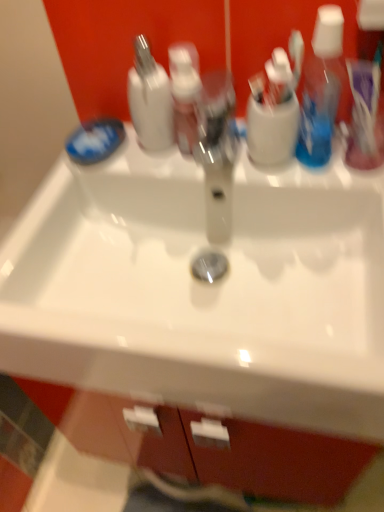
At what (x,y) coordinates should I click in order to perform the action: click on white glossy bottle at upper center. Please return your answer as a coordinate pair (x, y). This screenshot has width=384, height=512. Looking at the image, I should click on (150, 99).

The image size is (384, 512). What do you see at coordinates (150, 99) in the screenshot? I see `white glossy bottle at upper center` at bounding box center [150, 99].

Measure the distance between point (171, 82) and camera.

26.06 inches.

Find the location of `blue matte soap at left`. blue matte soap at left is located at coordinates (95, 140).

What do you see at coordinates (95, 140) in the screenshot?
I see `blue matte soap at left` at bounding box center [95, 140].

This screenshot has width=384, height=512. What do you see at coordinates (204, 290) in the screenshot?
I see `white glossy sink at center` at bounding box center [204, 290].

I want to click on translucent plastic toothbrush at upper right, so click(364, 102).

Describe the element at coordinates (364, 102) in the screenshot. This screenshot has height=512, width=384. I see `translucent plastic toothbrush at upper right` at that location.

Identify the location of white glossy bottle at upper center. (150, 99).

Is blue matte soap at left oriented away from white glossy bottle at upper center?

blue matte soap at left does not have its back to white glossy bottle at upper center.

Does blue matte soap at left have a greater height compared to white glossy bottle at upper center?

Incorrect, the height of blue matte soap at left is not larger of that of white glossy bottle at upper center.

Looking at this image, in terms of size, does blue matte soap at left appear bigger or smaller than white glossy bottle at upper center?

blue matte soap at left is smaller than white glossy bottle at upper center.

You are a GUI agent. You are given a task and a screenshot of the screen. Output one action in this format:
    pyautogui.click(x=<x>, y=<y>)
    Task: Click on the cleaning product above the blue matte soap at left (from the image's perspective)
    
    Given the screenshot: What is the action you would take?
    pyautogui.click(x=150, y=99)

Locate an element on the screen. toiletry on the right side of blue matte soap at left is located at coordinates (185, 94).

Is translucent pink pump bottle at center with blue matte soap at left?

No, translucent pink pump bottle at center is not with blue matte soap at left.

Which is correct: translucent pink pump bottle at center is inside blue matte soap at left, or outside of it?

The correct answer is: outside.

In terms of height, does translucent pink pump bottle at center look taller or shorter compared to blue matte soap at left?

In the image, translucent pink pump bottle at center appears to be taller than blue matte soap at left.

From the picture: From a real-world perspective, does translucent pink pump bottle at center sit lower than white glossy sink at center?

Actually, translucent pink pump bottle at center is physically above white glossy sink at center in the real world.

Is translucent pink pump bottle at center at the right side of white glossy sink at center?

No.

Consider the image. Can you confirm if translucent pink pump bottle at center is taller than white glossy sink at center?

Yes.

Can you tell me how much translucent pink pump bottle at center and white glossy sink at center differ in facing direction?

The facing directions of translucent pink pump bottle at center and white glossy sink at center are 0.00132 degrees apart.

From a real-world perspective, who is located lower, white glossy bottle at upper center or white glossy sink at center?

In real-world perspective, white glossy sink at center is lower.

Is white glossy bottle at upper center positioned far away from white glossy sink at center?

No, white glossy bottle at upper center is not far from white glossy sink at center.

Looking at the image, does white glossy bottle at upper center seem bigger or smaller compared to white glossy sink at center?

white glossy bottle at upper center is smaller than white glossy sink at center.

From the picture: Does white glossy bottle at upper center lie behind white glossy sink at center?

Yes, it is.

Looking at this image, could you tell me if translucent plastic toothbrush at upper right is turned towards white glossy bottle at upper center?

No, translucent plastic toothbrush at upper right is not aimed at white glossy bottle at upper center.

Is translucent plastic toothbrush at upper right next to white glossy bottle at upper center?

translucent plastic toothbrush at upper right and white glossy bottle at upper center are not in contact.

Between translucent plastic toothbrush at upper right and white glossy bottle at upper center, which one appears on the right side from the viewer's perspective?

From the viewer's perspective, translucent plastic toothbrush at upper right appears more on the right side.

Considering the relative sizes of translucent plastic toothbrush at upper right and white glossy bottle at upper center in the image provided, is translucent plastic toothbrush at upper right taller than white glossy bottle at upper center?

No, translucent plastic toothbrush at upper right is not taller than white glossy bottle at upper center.

Does white glossy bottle at upper center have a greater width compared to translucent pink pump bottle at center?

Indeed, white glossy bottle at upper center has a greater width compared to translucent pink pump bottle at center.

Does point (160, 105) come behind point (171, 57)?

That is True.

From a real-world perspective, is white glossy bottle at upper center on translucent pink pump bottle at center?

Yes, from a real-world perspective, white glossy bottle at upper center is on top of translucent pink pump bottle at center.

Looking at this image, can you confirm if white glossy sink at center is taller than blue matte soap at left?

Yes, white glossy sink at center is taller than blue matte soap at left.

From a real-world perspective, which object rests below the other?

From a 3D spatial view, white glossy sink at center is below.

From the image's perspective, is white glossy sink at center beneath blue matte soap at left?

Yes, from the image's perspective, white glossy sink at center is below blue matte soap at left.

Looking at their sizes, would you say white glossy sink at center is wider or thinner than blue matte soap at left?

Considering their sizes, white glossy sink at center looks broader than blue matte soap at left.

Identify the location of soap behind the white glossy bottle at upper center. This screenshot has width=384, height=512. (95, 140).

Where is `soap lying below the translucent pink pump bottle at center (from the image's perspective)`? Image resolution: width=384 pixels, height=512 pixels. soap lying below the translucent pink pump bottle at center (from the image's perspective) is located at coordinates (95, 140).

When comparing their distances from translucent plastic toothbrush at upper right, does translucent pink pump bottle at center or blue matte soap at left seem closer?

The object closer to translucent plastic toothbrush at upper right is translucent pink pump bottle at center.

Looking at the image, which one is located closer to translucent pink pump bottle at center, white glossy bottle at upper center or translucent plastic toothbrush at upper right?

white glossy bottle at upper center.

Consider the image. Estimate the real-world distances between objects in this image. Which object is further from white glossy sink at center, translucent pink pump bottle at center or blue matte soap at left?

The object further to white glossy sink at center is blue matte soap at left.

Based on their spatial positions, is white glossy bottle at upper center or white glossy sink at center closer to translucent pink pump bottle at center?

Among the two, white glossy bottle at upper center is located nearer to translucent pink pump bottle at center.

Estimate the real-world distances between objects in this image. Which object is further from translucent pink pump bottle at center, blue matte soap at left or white glossy bottle at upper center?

Based on the image, blue matte soap at left appears to be further to translucent pink pump bottle at center.

Considering their positions, is white glossy sink at center positioned closer to translucent plastic toothbrush at upper right than translucent pink pump bottle at center?

The object closer to translucent plastic toothbrush at upper right is translucent pink pump bottle at center.

Considering their positions, is white glossy sink at center positioned closer to white glossy bottle at upper center than blue matte soap at left?

blue matte soap at left.

In the scene shown: Looking at the image, which one is located further to white glossy bottle at upper center, white glossy sink at center or translucent pink pump bottle at center?

white glossy sink at center is further to white glossy bottle at upper center.

This screenshot has width=384, height=512. Identify the location of toiletry that lies between white glossy bottle at upper center and white glossy sink at center from top to bottom. (185, 94).

This screenshot has height=512, width=384. Find the location of `sink located between blue matte soap at left and translucent plastic toothbrush at upper right in the left-right direction`. sink located between blue matte soap at left and translucent plastic toothbrush at upper right in the left-right direction is located at coordinates (204, 290).

Where is `sink between translucent pink pump bottle at center and translucent plastic toothbrush at upper right`? The height and width of the screenshot is (512, 384). sink between translucent pink pump bottle at center and translucent plastic toothbrush at upper right is located at coordinates (204, 290).

Find the location of `toiletry located between white glossy bottle at upper center and translucent plastic toothbrush at upper right in the left-right direction`. toiletry located between white glossy bottle at upper center and translucent plastic toothbrush at upper right in the left-right direction is located at coordinates (185, 94).